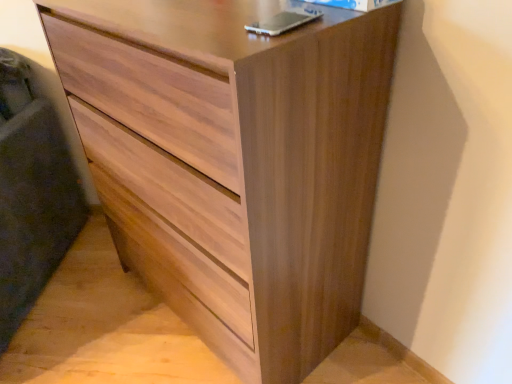
Where is `walnut wood chest of drawers at center`? The width and height of the screenshot is (512, 384). walnut wood chest of drawers at center is located at coordinates (234, 161).

Describe the element at coordinates (234, 161) in the screenshot. I see `walnut wood chest of drawers at center` at that location.

Identify the location of walnut wood chest of drawers at center. This screenshot has height=384, width=512. (234, 161).